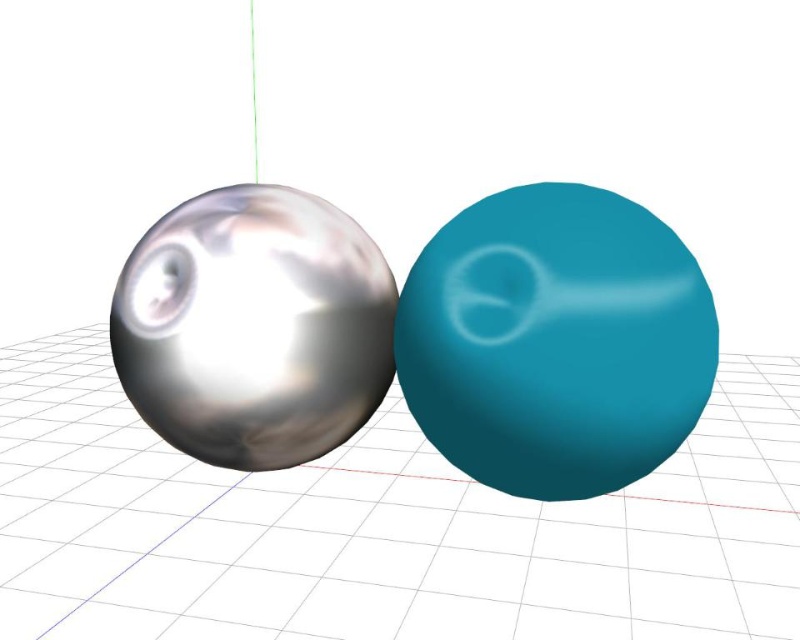
Is point (778, 448) farther from viewer compared to point (690, 288)?

Yes, it is behind point (690, 288).

Does metallic sphere at center lie behind teal rubber bowling ball at center?

Yes.

This screenshot has height=640, width=800. What are the coordinates of `metallic sphere at center` in the screenshot? It's located at (381, 528).

You are a GUI agent. You are given a task and a screenshot of the screen. Output one action in this format:
    pyautogui.click(x=<x>, y=<y>)
    Task: Click on the metallic sphere at center
    The width and height of the screenshot is (800, 640).
    Given the screenshot: What is the action you would take?
    pyautogui.click(x=381, y=528)